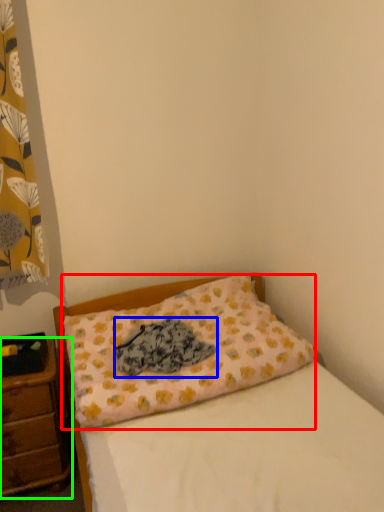
Question: Considering the real-world distances, which object is farthest from pillow (highlighted by a red box)? material (highlighted by a blue box) or nightstand (highlighted by a green box)?

Choices:
 (A) material
 (B) nightstand

Answer: (B)